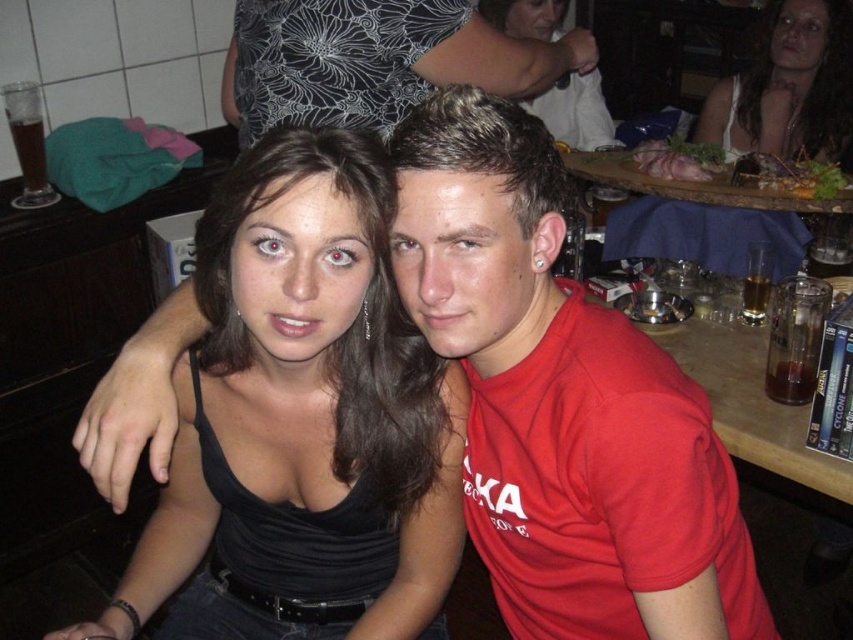
Question: Does black matte tank top at center appear under white matte dress at upper right?

Choices:
 (A) yes
 (B) no

Answer: (A)

Question: Observing the image, what is the correct spatial positioning of black matte tank top at center in reference to white matte dress at upper right?

Choices:
 (A) below
 (B) above

Answer: (A)

Question: Among these objects, which one is nearest to the camera?

Choices:
 (A) white matte dress at upper right
 (B) black matte tank top at center

Answer: (B)

Question: Which of the following is the closest to the observer?

Choices:
 (A) black matte tank top at center
 (B) white matte dress at upper right

Answer: (A)

Question: Can you confirm if black matte tank top at center is smaller than white matte dress at upper right?

Choices:
 (A) no
 (B) yes

Answer: (A)